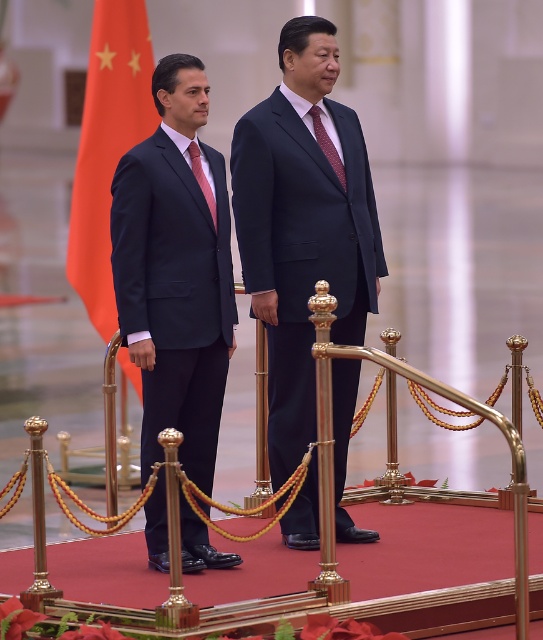
You are a photographer at the event and need to adjust your camera to focus on both the matte black suit at left and the maroon textured tie at center. Which object should you focus on first to ensure proper depth of field?

The matte black suit at left is below the maroon textured tie at center, so you should focus on the matte black suit at left first to ensure proper depth of field since it is closer to the camera.

You are a photographer positioned at the center of the stage. You need to capture a photo where both the orange fabric flag at left and the maroon textured tie at center are visible in the frame. Given that your camera has a maximum horizontal field of view of 10 meters, will you be able to fit both objects into the same photograph?

The orange fabric flag at left and maroon textured tie at center are 10.67 meters apart. Since the camera can only capture up to 10 meters horizontally, the distance between them exceeds the camera capabilities. Therefore, it will not be possible to include both objects in the same photograph.

Consider the image. You are a photographer setting up for a formal event. You need to position a spotlight so it can illuminate both the matte black suit at left and the maroon textured tie at center without overlapping their light beams. Given their spatial arrangement, is this possible?

The matte black suit at left occupies less space than maroon textured tie at center, so the spotlight can be positioned to illuminate both without overlapping their light beams as the maroon textured tie at center takes up more area.